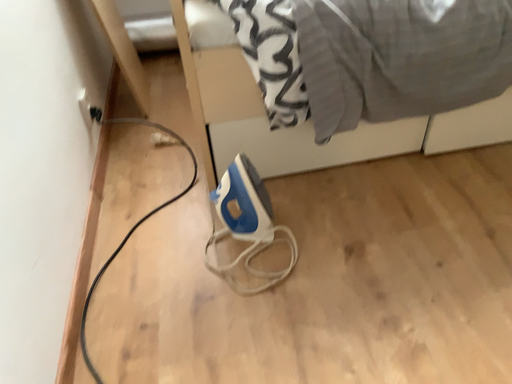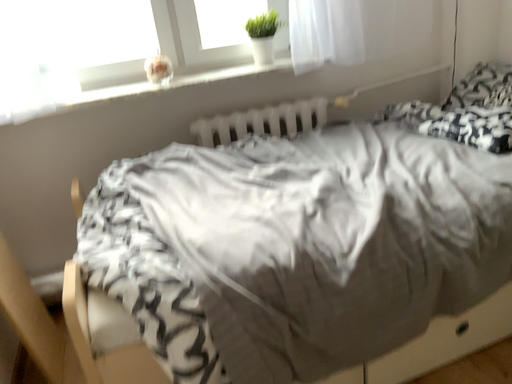
Question: Which way did the camera rotate in the video?

Choices:
 (A) rotated upward
 (B) rotated downward

Answer: (A)